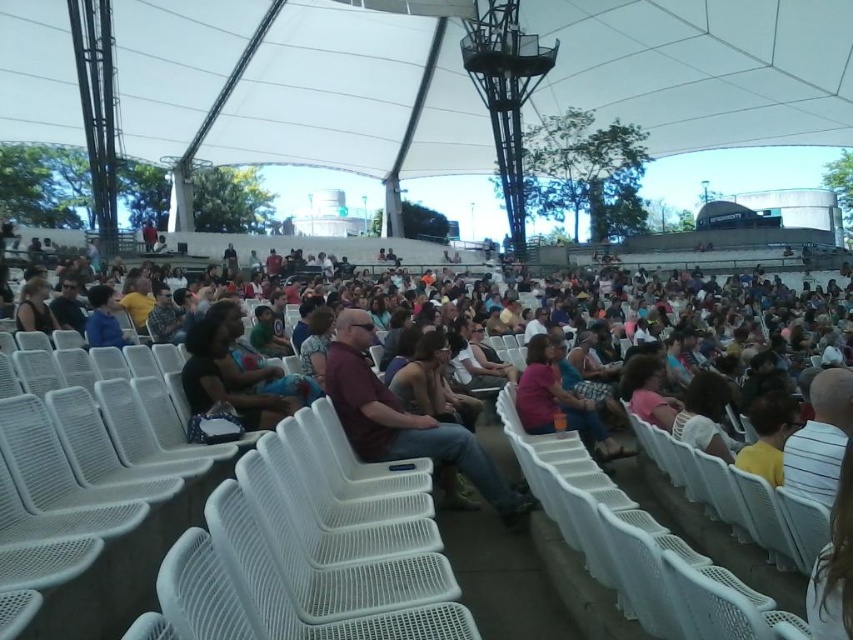
You are an event organizer trying to arrange a photo shoot. You notice two attendees wearing dark blue fabric shirt at center and matte blue shirt at center. Which attendee should you choose if you want someone with a more fitted clothing style?

The dark blue fabric shirt at center has a lesser width compared to matte blue shirt at center, so the attendee wearing the dark blue fabric shirt at center has a more fitted clothing style and should be chosen for the photo shoot.

You are standing at the entrance of the amphitheater and want to reach the point marked as point (175, 326). If your walking speed is 1.5 meters per second, how long will it take you to reach that point?

The point (175, 326) is 34.67 meters away from the viewer. At a walking speed of 1.5 meters per second, it would take approximately 23.11 seconds to reach the point.

You are an event organizer checking the seating arrangement. You notice two attendees wearing shirts labeled as dark blue fabric shirt at center and matte blue shirt at center. Which attendee is sitting in a seat that allows more space for their shirt?

The matte blue shirt at center occupies more space than the dark blue fabric shirt at center, so the attendee wearing the matte blue shirt at center has a seat with more space for their shirt.